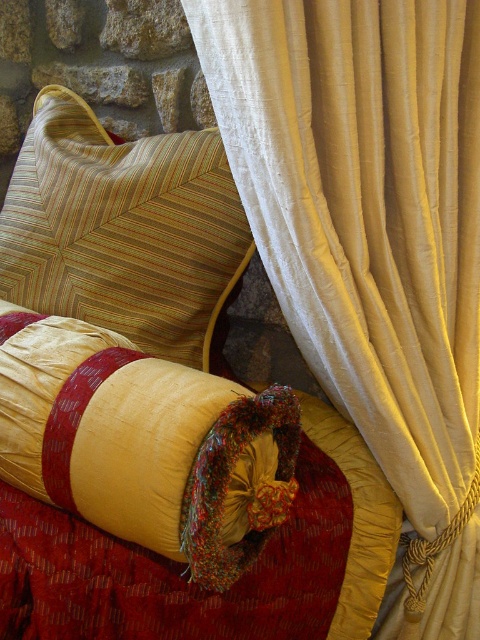
You are arranging a sofa for a photo shoot and need to place the velvet gold throw pillow at center and the striped fabric cushion at upper left. Given that the sofa has limited depth, which cushion should you place first to ensure both fit?

The velvet gold throw pillow at center is thinner than the striped fabric cushion at upper left, so you should place the striped fabric cushion at upper left first to accommodate its greater thickness before adding the thinner velvet gold throw pillow at center.

You are standing at the origin point in the image and want to reach the point at coordinates point (192,576). Is the point at coordinates point (285,83) blocking your path?

Point (285,83) is behind point (192,576), so it is not blocking the path to point (192,576).